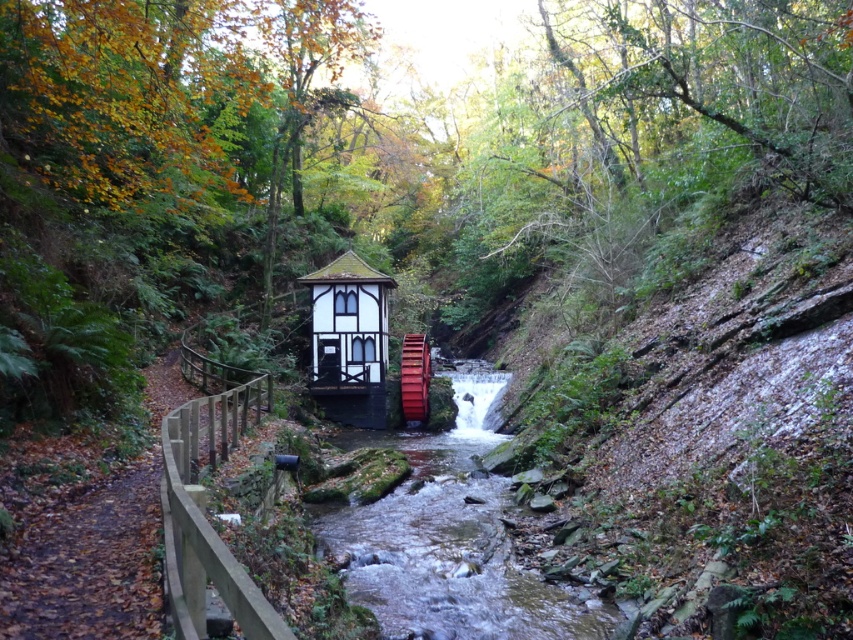
You are planning to build a small wooden bridge over the stream. The bridge must be 10 meters wide to accommodate two lanes of traffic. Given the available space between the smooth concrete creek at center and the white wood gazebo at center, can the bridge be constructed without any modifications?

The smooth concrete creek at center is wider than the white wood gazebo at center. However, the description does not provide specific measurements for their widths. Without knowing the exact width of the creek, it is impossible to determine if the 10 meter wide bridge can be constructed. Additional information about the creek and gazebo dimensions is required.

From the picture: You are standing at the edge of the smooth concrete creek at center and want to walk to the white wood gazebo at center. Which direction should you move to get closer to the gazebo?

Since the smooth concrete creek at center is closer to the viewer than the white wood gazebo at center, you should move backward away from the creek towards the gazebo to get closer to it.

You are planning to build a small wooden bridge over the stream. The bridge must be wide enough to allow a bicycle to pass. Given the sizes of the smooth concrete creek at center and the white wood gazebo at center, which object should you consider when determining the minimum width of the bridge?

The smooth concrete creek at center has a larger size compared to the white wood gazebo at center. Therefore, the bridge should be at least as wide as the smooth concrete creek at center to accommodate a bicycle.